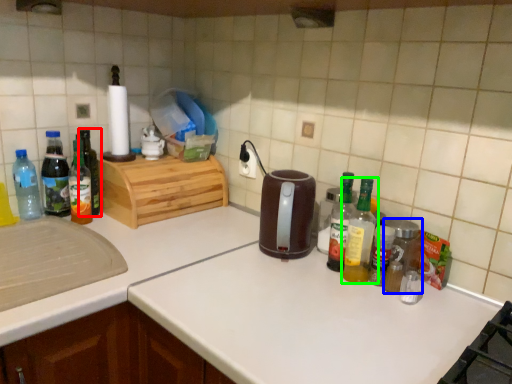
Question: Which object is the farthest from bottle (highlighted by a red box)? Choose among these: bottle (highlighted by a blue box) or bottle (highlighted by a green box).

Choices:
 (A) bottle
 (B) bottle

Answer: (A)